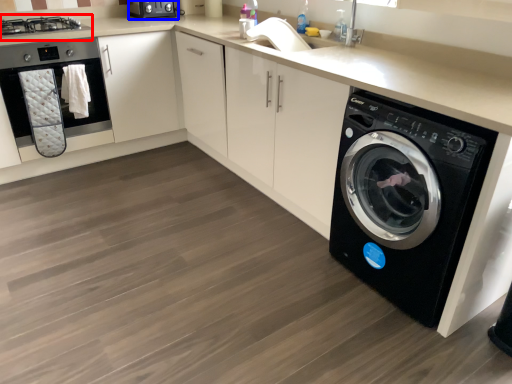
Question: Which object appears farthest to the camera in this image, stove (highlighted by a red box) or appliance (highlighted by a blue box)?

Choices:
 (A) stove
 (B) appliance

Answer: (B)